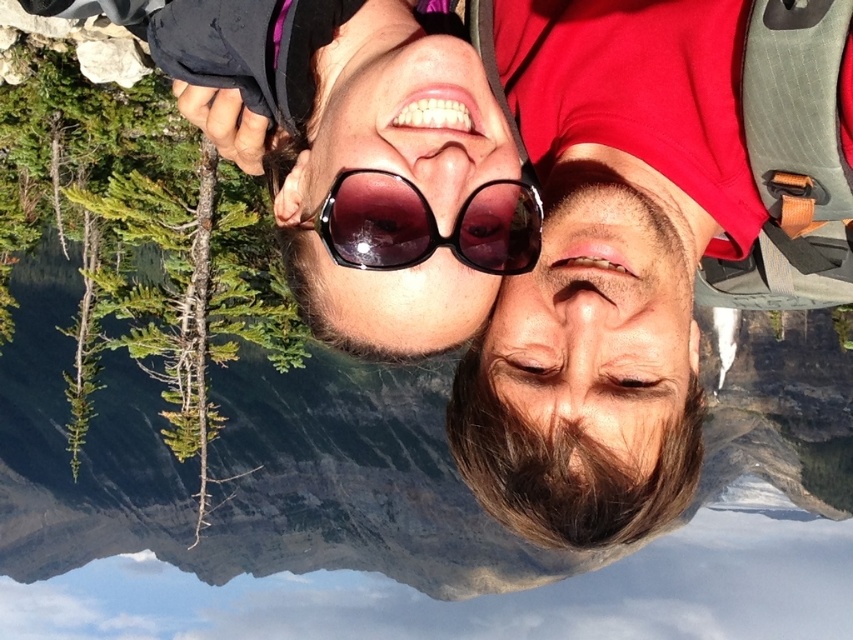
Which is behind, point (494, 483) or point (358, 205)?

Point (494, 483)

Identify the location of matte red shirt at right. tap(648, 243).